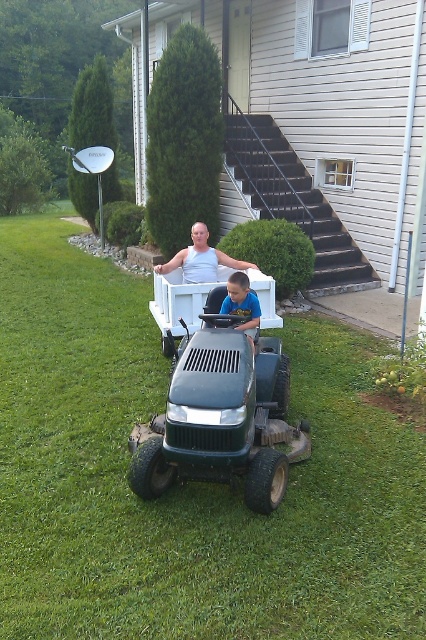
Question: Can you confirm if green grass at center is wider than white tank top at center?

Choices:
 (A) yes
 (B) no

Answer: (A)

Question: Which point is farther from the camera taking this photo?

Choices:
 (A) (77, 586)
 (B) (252, 304)
 (C) (206, 260)
 (D) (189, 285)

Answer: (C)

Question: Is green grass at center smaller than white tank top at center?

Choices:
 (A) yes
 (B) no

Answer: (B)

Question: Which point is closer to the camera taking this photo?

Choices:
 (A) (144, 332)
 (B) (167, 266)

Answer: (B)

Question: In this image, where is white plastic wagon at center located relative to blue cotton shirt at center?

Choices:
 (A) below
 (B) above

Answer: (B)

Question: Based on their relative distances, which object is nearer to the white plastic wagon at center?

Choices:
 (A) blue cotton shirt at center
 (B) green grass at center

Answer: (A)